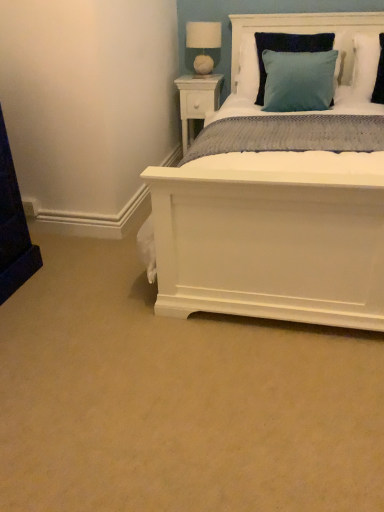
Where is `free spot above white wood nightstand at upper center (from a real-world perspective)`? free spot above white wood nightstand at upper center (from a real-world perspective) is located at coordinates (197, 77).